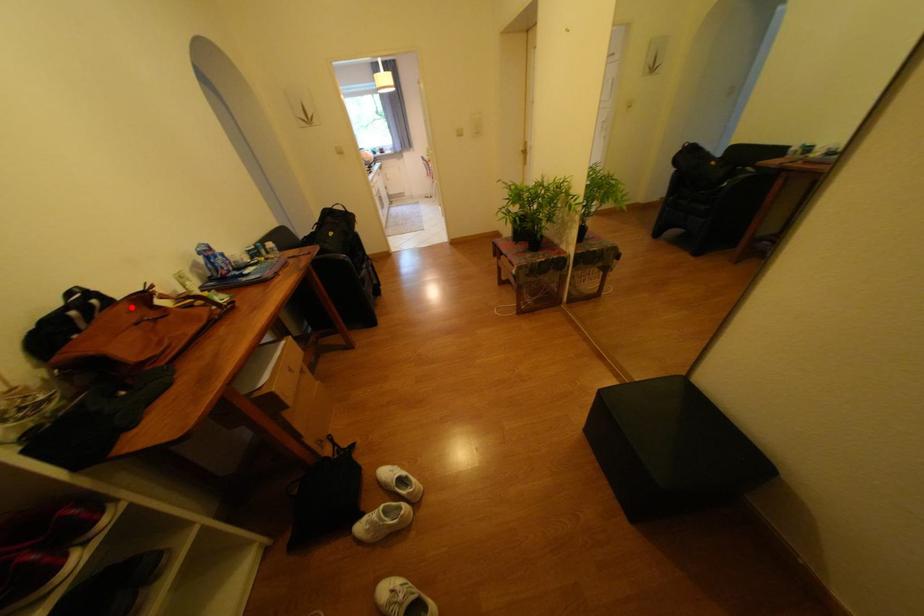
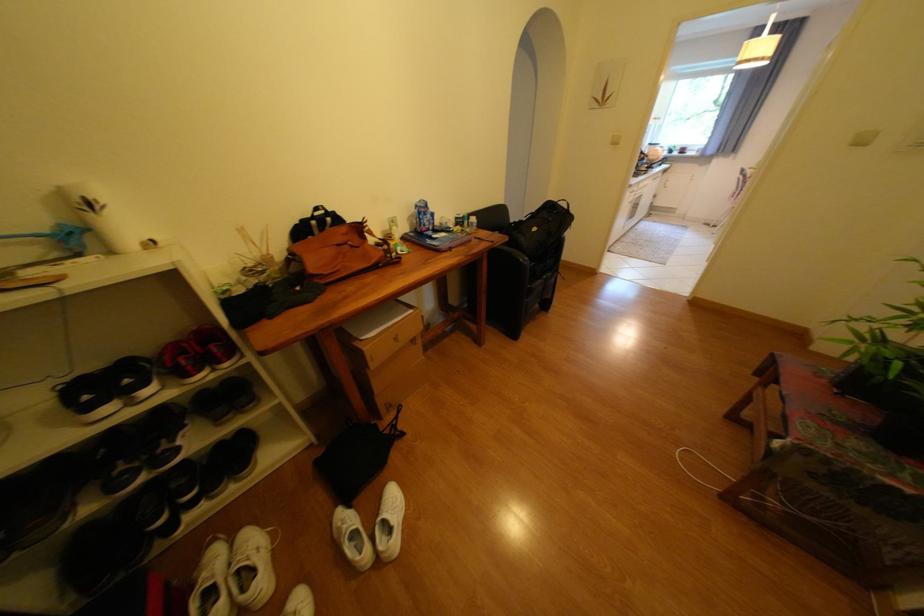
The point at the highlighted location is marked in the first image. Where is the corresponding point in the second image?

(351, 229)